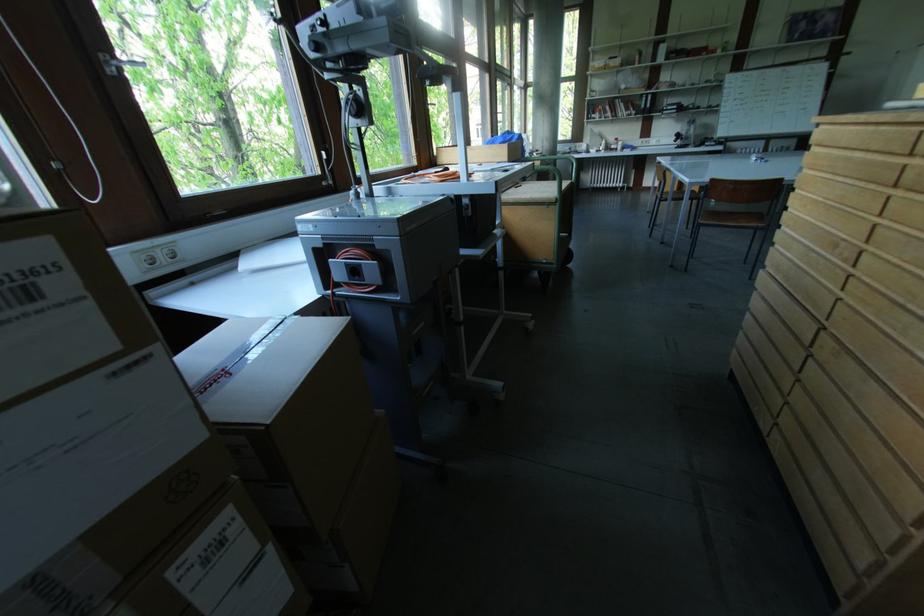
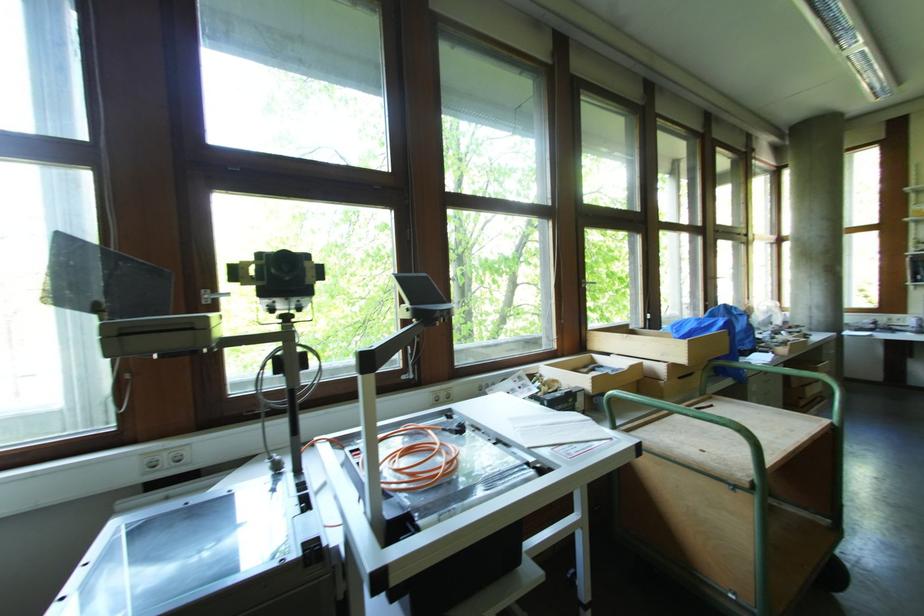
Locate, in the second image, the point that corresponds to pixel 144 259 in the first image.

(151, 462)